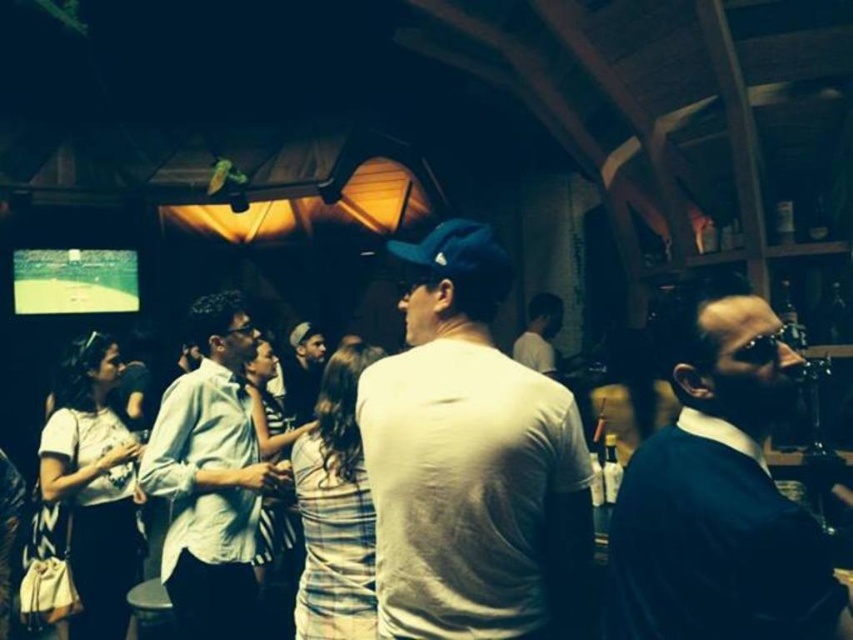
Who is more distant from viewer, (192, 529) or (300, 397)?

Point (300, 397)

Can you confirm if light blue striped shirt at center is positioned below dark gray knit cap at center?

Correct, light blue striped shirt at center is located below dark gray knit cap at center.

Find the location of a particular element. The width and height of the screenshot is (853, 640). light blue striped shirt at center is located at coordinates (212, 476).

Is dark blue sweater at right bigger than dark gray knit cap at center?

No, dark blue sweater at right is not bigger than dark gray knit cap at center.

Can you confirm if dark blue sweater at right is positioned below dark gray knit cap at center?

Indeed, dark blue sweater at right is positioned under dark gray knit cap at center.

Between point (628, 545) and point (308, 324), which one is positioned in front?

Point (628, 545) is in front.

Identify the location of dark blue sweater at right. This screenshot has width=853, height=640. (718, 492).

Does dark gray knit cap at center appear on the left side of white matte shirt at center?

Indeed, dark gray knit cap at center is positioned on the left side of white matte shirt at center.

Does dark gray knit cap at center have a smaller size compared to white matte shirt at center?

No, dark gray knit cap at center is not smaller than white matte shirt at center.

This screenshot has width=853, height=640. Find the location of `dark gray knit cap at center`. dark gray knit cap at center is located at coordinates (302, 371).